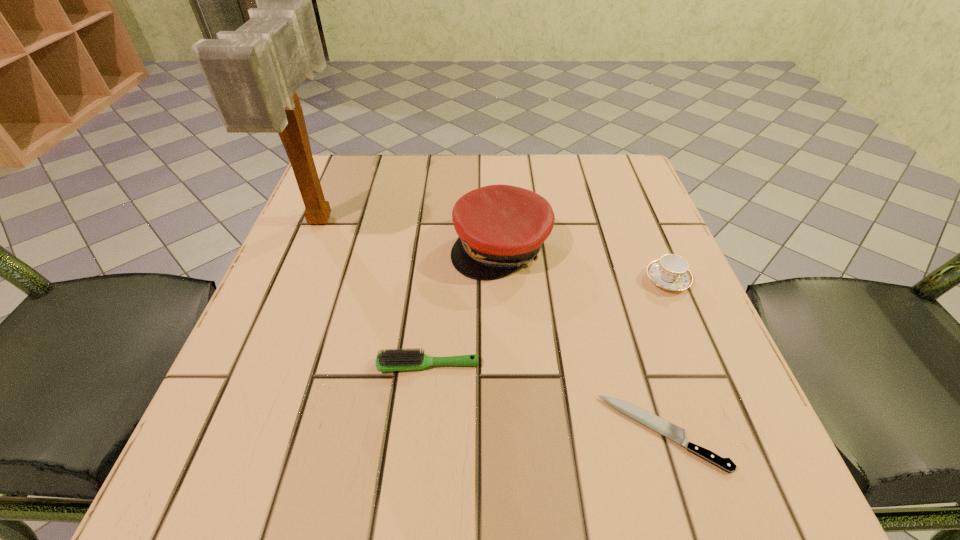
I want to click on vacant region at the far edge of the desktop, so click(406, 184).

In the image, there is a desktop. Identify the location of vacant space at the near edge. The height and width of the screenshot is (540, 960). (527, 494).

Identify the location of vacant space at the left edge of the desktop. The width and height of the screenshot is (960, 540). (248, 338).

Find the location of a particular element. Image resolution: width=960 pixels, height=540 pixels. vacant space at the right edge of the desktop is located at coordinates (635, 346).

You are a GUI agent. You are given a task and a screenshot of the screen. Output one action in this format:
    pyautogui.click(x=<x>, y=<y>)
    Task: Click on the vacant space at the far left corner of the desktop
    
    Given the screenshot: What is the action you would take?
    pyautogui.click(x=368, y=207)

What are the coordinates of `vacant space at the near left corner` in the screenshot? It's located at (212, 441).

In the image, there is a desktop. Where is `blank space at the far right corner`? The height and width of the screenshot is (540, 960). blank space at the far right corner is located at coordinates (569, 169).

Identify the location of free space between the mallet and the fourth shortest object. Image resolution: width=960 pixels, height=540 pixels. pos(411,233).

At what (x,y) coordinates should I click in order to perform the action: click on unoccupied position between the second nearest object and the teacup. Please return your answer as a coordinate pair (x, y). Looking at the image, I should click on (547, 322).

I want to click on free space between the fourth shortest object and the steak knife, so click(x=582, y=340).